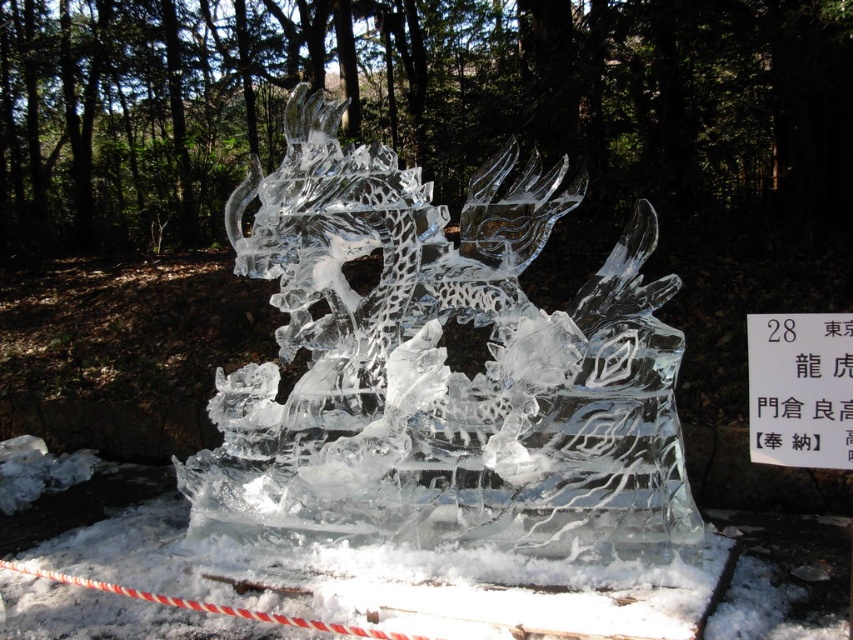
You are an artist planning to photograph the transparent ice dragon at center and the white paper at center. Which object should you focus on first if you want to capture both in a single frame without moving the camera, considering their sizes?

The transparent ice dragon at center is larger in size than the white paper at center, so you should focus on the transparent ice dragon at center first to ensure it fills the frame appropriately before adjusting for the smaller white paper at center.

You are a photographer standing in front of the ice dragon sculpture. You want to take a photo that includes both the point at coordinates point (160, 604) and point (788, 342). Which point should you focus on first to ensure both are in sharp focus?

You should focus on point (160, 604) first because it is closer to you than point (788, 342), ensuring that both points will be within the depth of field when focused on the closer point.

You are standing at the center of a winter garden and see the transparent ice dragon at center. If you want to walk directly towards the dragon, which direction should you face?

Since the transparent ice dragon at center is located at point coordinates of (x=440, y=371), you should face slightly to the right and forward to walk directly towards it. The dragon is positioned to the northeast relative to your current position at the center.